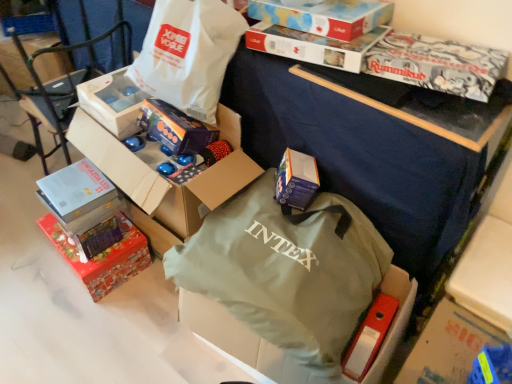
You are a GUI agent. You are given a task and a screenshot of the screen. Output one action in this format:
    pyautogui.click(x=<x>, y=<y>)
    Task: Click on the vacant area that is in front of matte purple gift box at center
    The height and width of the screenshot is (384, 512).
    Given the screenshot: What is the action you would take?
    pyautogui.click(x=160, y=159)